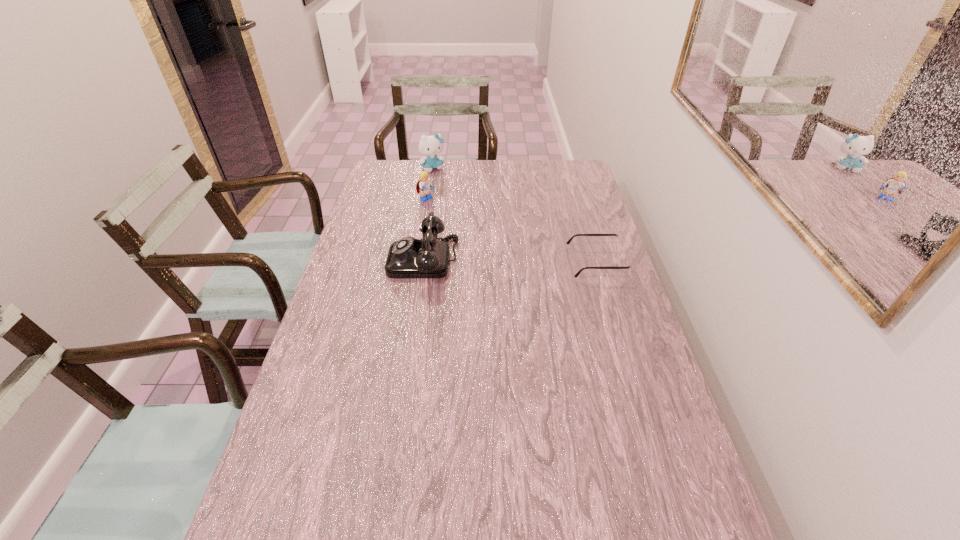
Locate an element on the screen. The width and height of the screenshot is (960, 540). free space at the right edge of the desktop is located at coordinates (581, 261).

In the image, there is a desktop. Where is `vacant space at the far right corner`? The height and width of the screenshot is (540, 960). vacant space at the far right corner is located at coordinates (572, 167).

Where is `unoccupied position between the farthest object and the shortest object`? unoccupied position between the farthest object and the shortest object is located at coordinates (515, 215).

Identify the location of vacant space that is in between the rightmost object and the telephone. (510, 261).

Locate an element on the screen. Image resolution: width=960 pixels, height=540 pixels. free point between the spectacles and the farthest object is located at coordinates (515, 215).

The image size is (960, 540). What are the coordinates of `empty location between the telephone and the rightmost object` in the screenshot? It's located at (510, 261).

Image resolution: width=960 pixels, height=540 pixels. I want to click on unoccupied area between the kitten and the telephone, so click(428, 214).

The image size is (960, 540). Identify the location of vacant area between the farthest object and the rightmost object. (515, 215).

At what (x,y) coordinates should I click in order to perform the action: click on vacant space that's between the telephone and the spectacles. Please return your answer as a coordinate pair (x, y). This screenshot has height=540, width=960. Looking at the image, I should click on (510, 261).

Locate an element on the screen. The height and width of the screenshot is (540, 960). free point between the telephone and the farthest object is located at coordinates (428, 214).